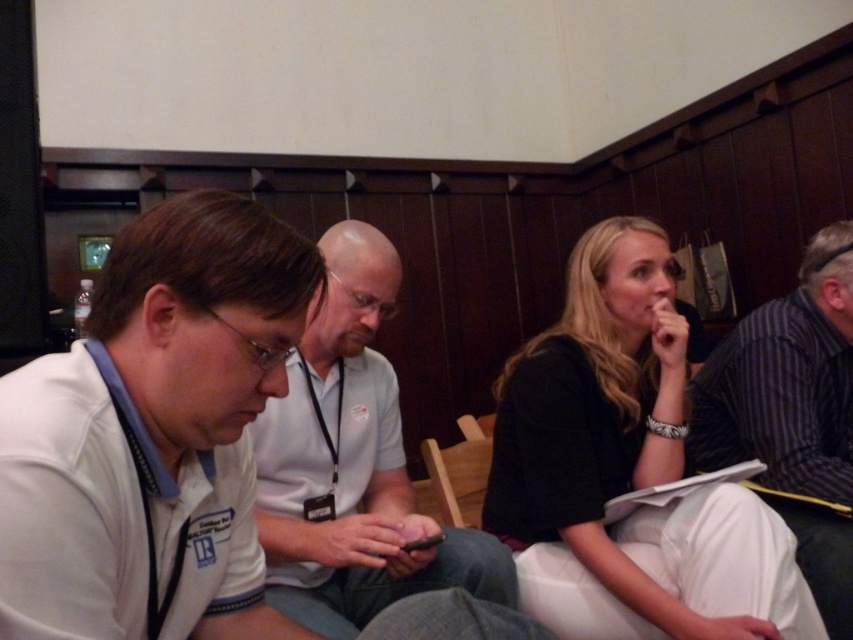
Question: Is black matte jacket at upper right wider than striped cotton shirt at right?

Choices:
 (A) no
 (B) yes

Answer: (B)

Question: Based on their relative distances, which object is nearer to the black matte jacket at upper right?

Choices:
 (A) white matte shirt at left
 (B) striped cotton shirt at right

Answer: (B)

Question: From the image, what is the correct spatial relationship of black matte jacket at upper right in relation to striped cotton shirt at right?

Choices:
 (A) left
 (B) right

Answer: (A)

Question: Among these objects, which one is nearest to the camera?

Choices:
 (A) white matte shirt at left
 (B) striped cotton shirt at right
 (C) black matte jacket at upper right

Answer: (A)

Question: Observing the image, what is the correct spatial positioning of white matte shirt at left in reference to striped cotton shirt at right?

Choices:
 (A) below
 (B) above

Answer: (B)

Question: Which is nearer to the black matte jacket at upper right?

Choices:
 (A) striped cotton shirt at right
 (B) white matte shirt at center

Answer: (B)